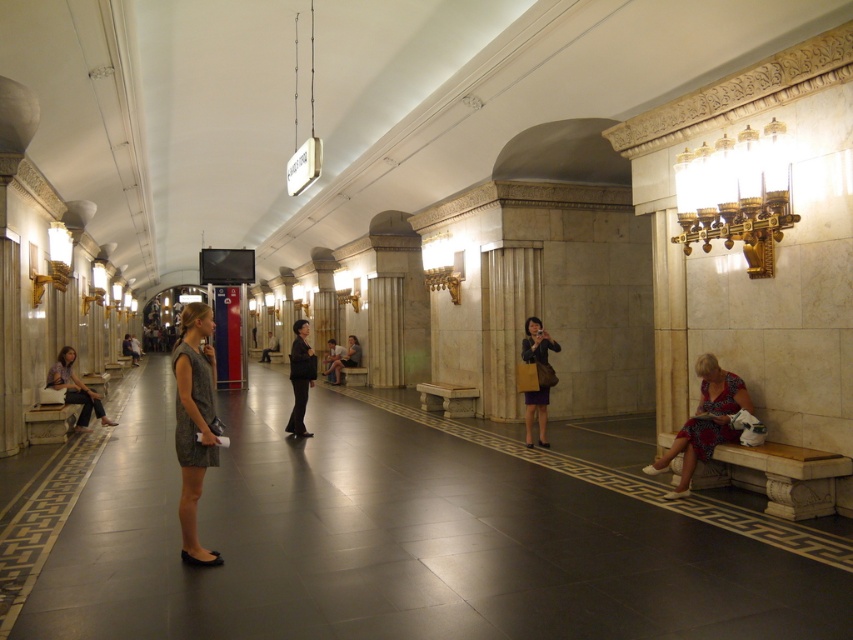
Which is below, matte brown coat at center or black leather jacket at center?

black leather jacket at center is below.

This screenshot has height=640, width=853. What do you see at coordinates (537, 342) in the screenshot? I see `matte brown coat at center` at bounding box center [537, 342].

Between point (546, 353) and point (299, 385), which one is positioned in front?

Point (546, 353)

The height and width of the screenshot is (640, 853). Identify the location of matte brown coat at center. (537, 342).

Which is more to the left, printed fabric dress at right or black leather jacket at center?

black leather jacket at center

Does printed fabric dress at right have a lesser width compared to black leather jacket at center?

No, printed fabric dress at right is not thinner than black leather jacket at center.

Where is `printed fabric dress at right`? printed fabric dress at right is located at coordinates (704, 422).

The image size is (853, 640). Identify the location of printed fabric dress at right. (704, 422).

Can you confirm if black leather jacket at center is positioned to the right of matte purple dress at left?

Indeed, black leather jacket at center is positioned on the right side of matte purple dress at left.

Can you confirm if black leather jacket at center is bigger than matte purple dress at left?

No, black leather jacket at center is not bigger than matte purple dress at left.

Does point (310, 433) come behind point (62, 360)?

That is False.

Where is `black leather jacket at center`? This screenshot has height=640, width=853. black leather jacket at center is located at coordinates (300, 378).